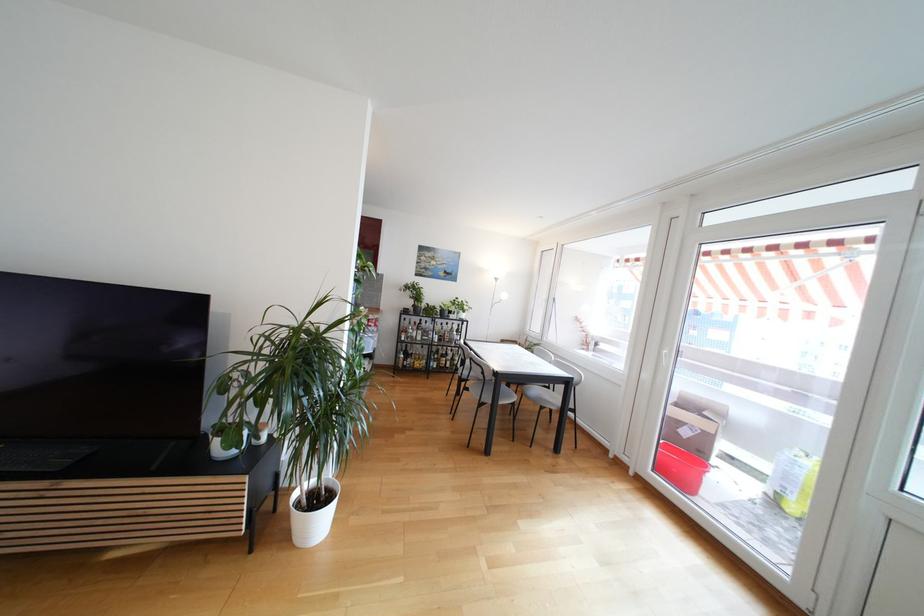
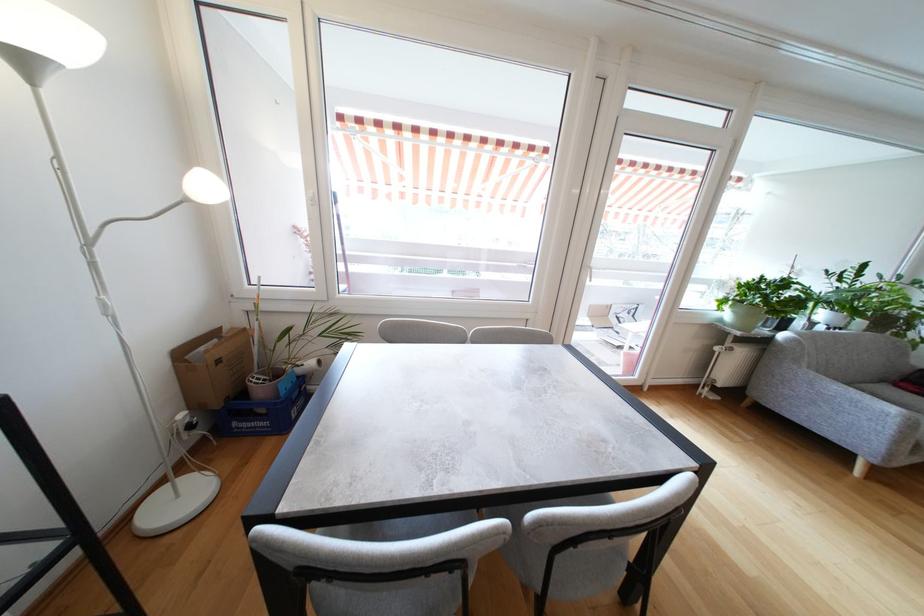
Locate, in the second image, the point that corresponds to [496,309] in the first image.

(93, 246)